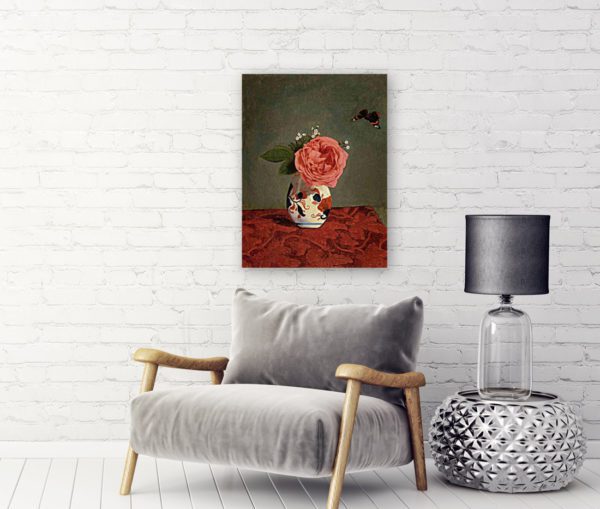
Where is `wall painting`? wall painting is located at coordinates (375, 172).